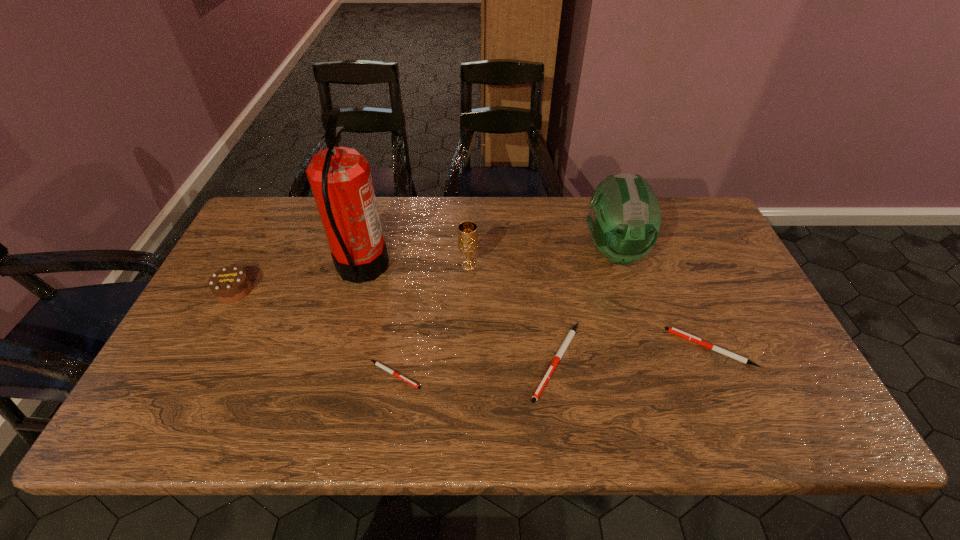
Please point a vacant point for placing a pen on the left. Please provide its 2D coordinates. Your answer should be formatted as a tuple, i.e. [(x, y)], where the tuple contains the x and y coordinates of a point satisfying the conditions above.

[(225, 389)]